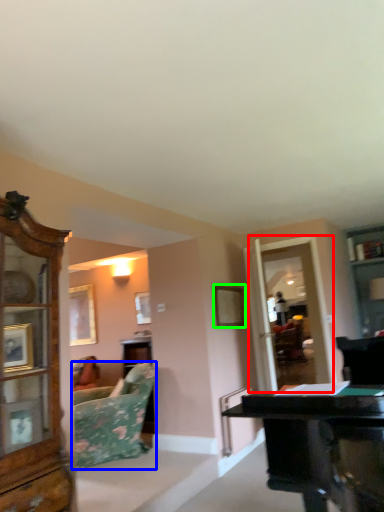
Question: Estimate the real-world distances between objects in this image. Which object is farther from glass door (highlighted by a red box), studio couch (highlighted by a blue box) or picture frame (highlighted by a green box)?

Choices:
 (A) studio couch
 (B) picture frame

Answer: (A)